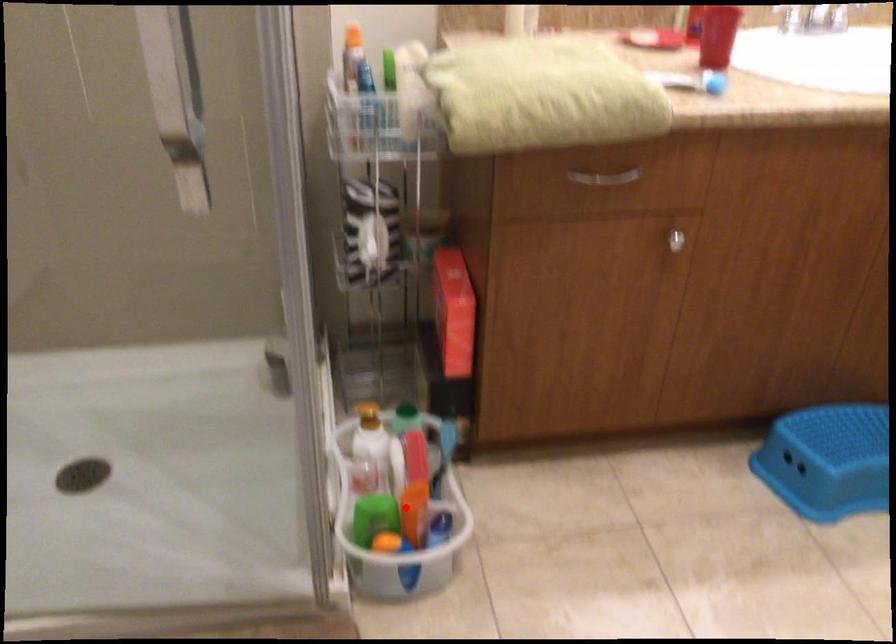
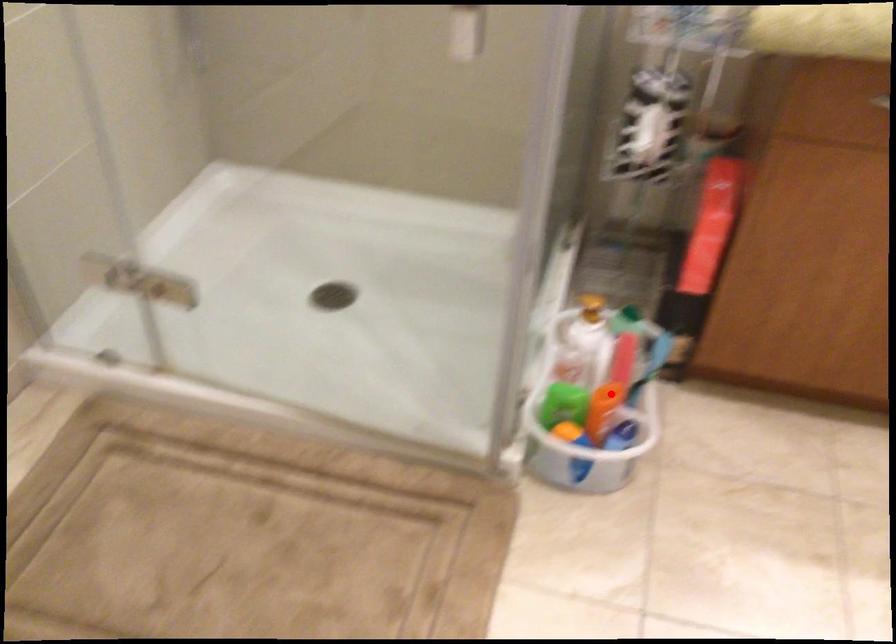
I am providing you with two images of the same scene from different viewpoints. A red point is marked on the first image and another point is marked on the second image. Is the marked point in image1 the same physical position as the marked point in image2?

No